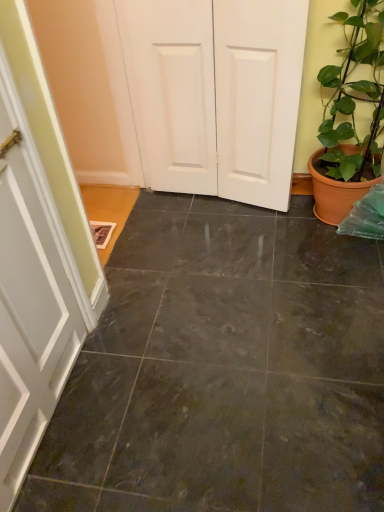
Find the location of a particular element. blank space situated above dark gray tile floor at center (from a real-world perspective) is located at coordinates (259, 319).